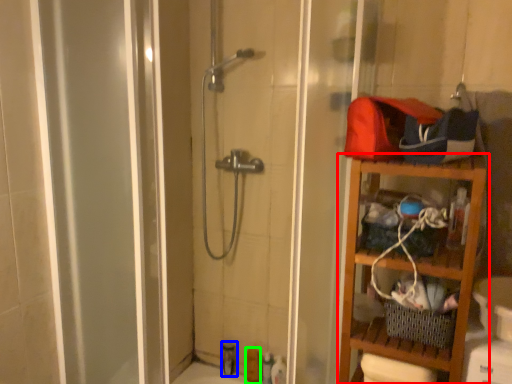
Question: Based on their relative distances, which object is farther from shelf (highlighted by a red box)? Choose from toiletry (highlighted by a blue box) and toiletry (highlighted by a green box).

Choices:
 (A) toiletry
 (B) toiletry

Answer: (A)